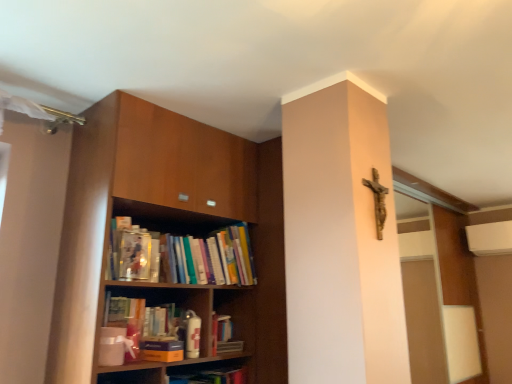
Question: Is blue matte paperback book at lower center to the left or to the right of wooden bookshelf at left in the image?

Choices:
 (A) left
 (B) right

Answer: (B)

Question: From a real-world perspective, is blue matte paperback book at lower center physically located above or below wooden bookshelf at left?

Choices:
 (A) below
 (B) above

Answer: (A)

Question: Does point (165, 349) appear closer or farther from the camera than point (81, 162)?

Choices:
 (A) closer
 (B) farther

Answer: (A)

Question: Considering their positions, is wooden bookshelf at left located in front of or behind blue matte paperback book at lower center?

Choices:
 (A) front
 (B) behind

Answer: (A)

Question: Considering the positions of wooden bookshelf at left and blue matte paperback book at lower center in the image, is wooden bookshelf at left wider or thinner than blue matte paperback book at lower center?

Choices:
 (A) wide
 (B) thin

Answer: (A)

Question: Is point (62, 279) closer or farther from the camera than point (154, 340)?

Choices:
 (A) closer
 (B) farther

Answer: (A)

Question: Which is correct: wooden bookshelf at left is inside blue matte paperback book at lower center, or outside of it?

Choices:
 (A) inside
 (B) outside

Answer: (B)